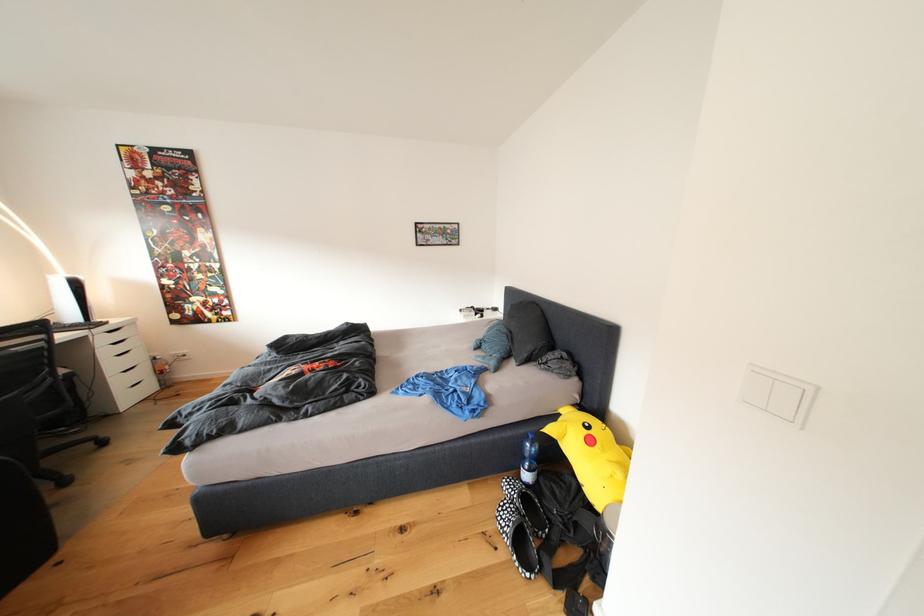
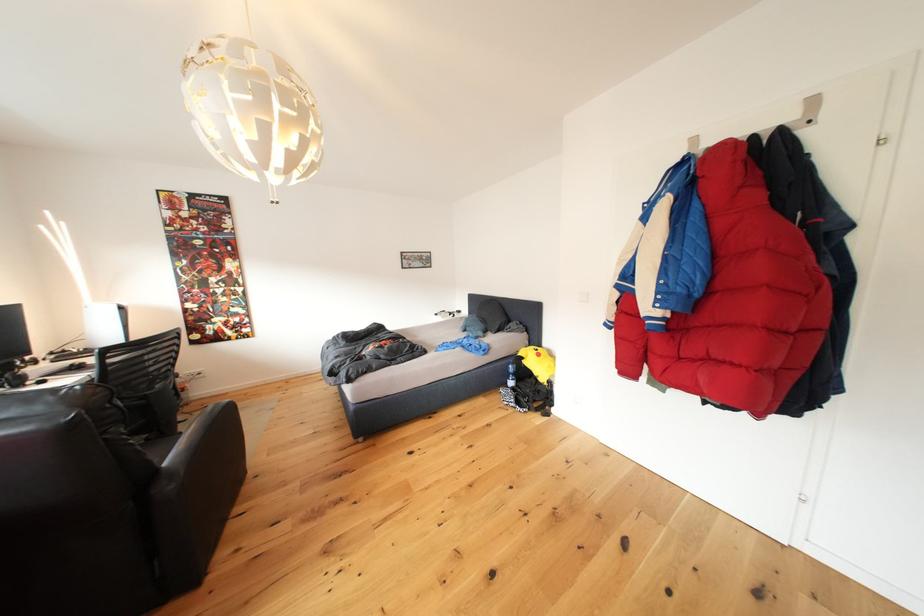
Which direction would the cameraman need to move to produce the second image?

The cameraman moved toward left, backward.